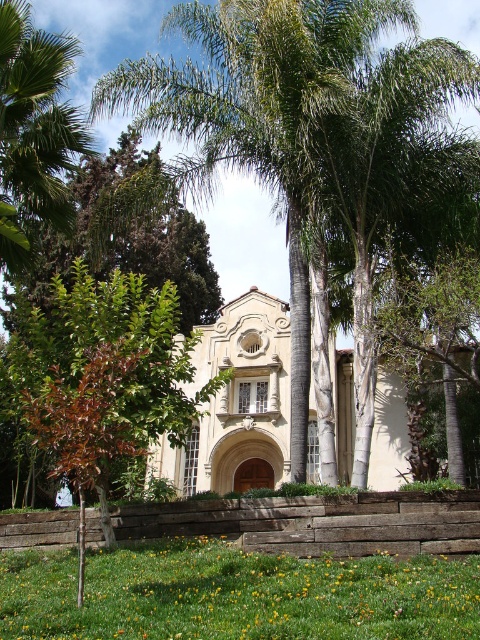
Is green leafy palm tree at center smaller than green leafy palm tree at left?

No.

Does green leafy palm tree at center come in front of green leafy palm tree at left?

Yes, green leafy palm tree at center is closer to the viewer.

Between point (200, 4) and point (59, 113), which one is positioned in front?

Positioned in front is point (59, 113).

Where is `green leafy palm tree at center`? The width and height of the screenshot is (480, 640). green leafy palm tree at center is located at coordinates (307, 138).

Is green leafy palm tree at center further to camera compared to green grass at lower center?

Yes, green leafy palm tree at center is behind green grass at lower center.

Is point (308, 156) more distant than point (175, 568)?

That is True.

Identify the location of green leafy palm tree at center. Image resolution: width=480 pixels, height=640 pixels. (307, 138).

Measure the distance from green grass at lower center to green leafy palm tree at left.

31.10 meters

Does point (323, 600) lie behind point (43, 60)?

No, it is not.

Who is more forward, (108, 636) or (13, 237)?

Point (108, 636) is in front.

The height and width of the screenshot is (640, 480). I want to click on green grass at lower center, so click(x=235, y=595).